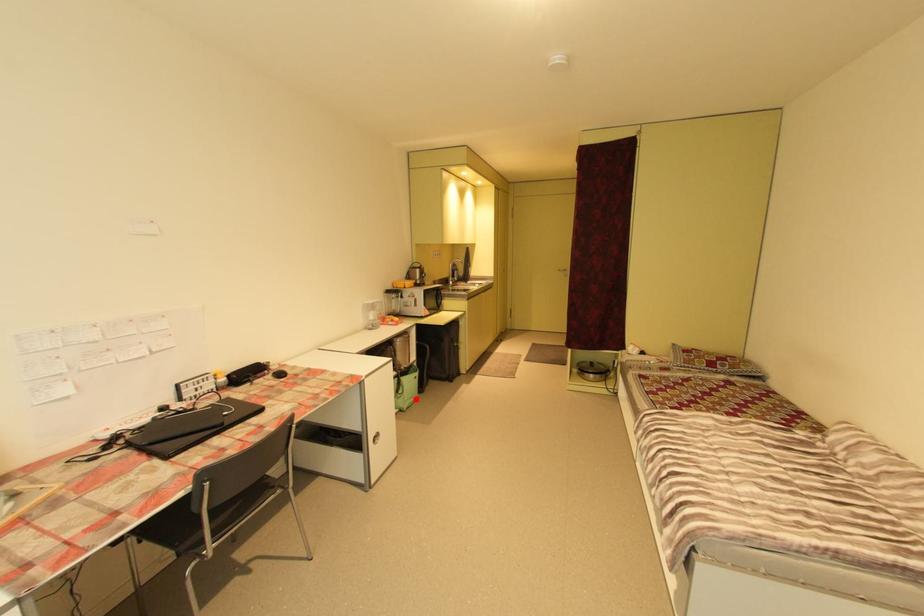
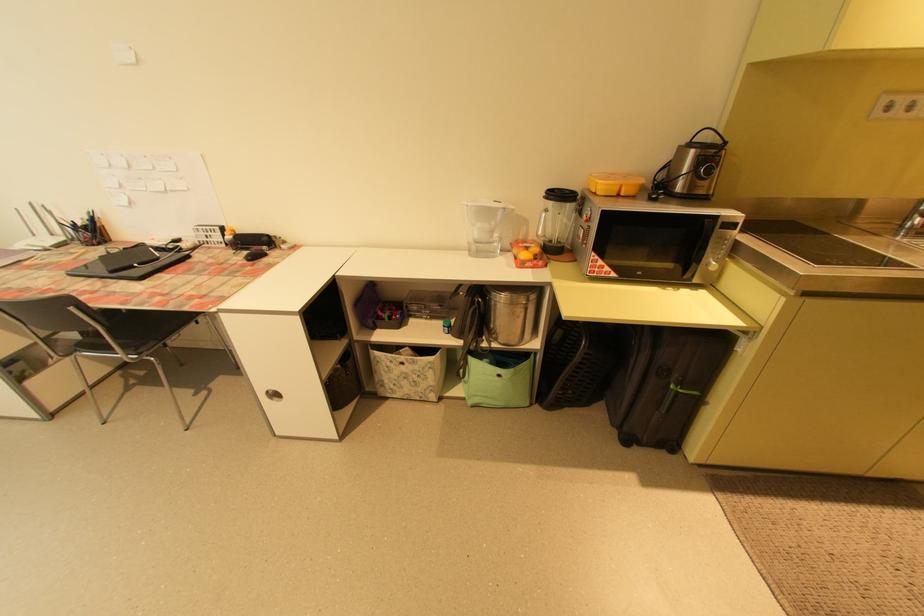
Locate, in the second image, the point that corresponds to the highlighted location in the first image.

(492, 398)